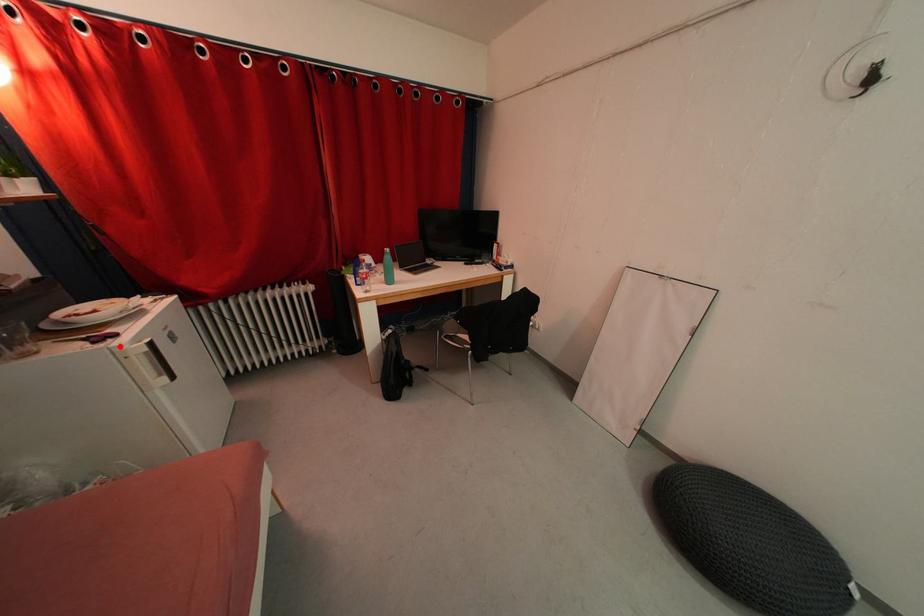
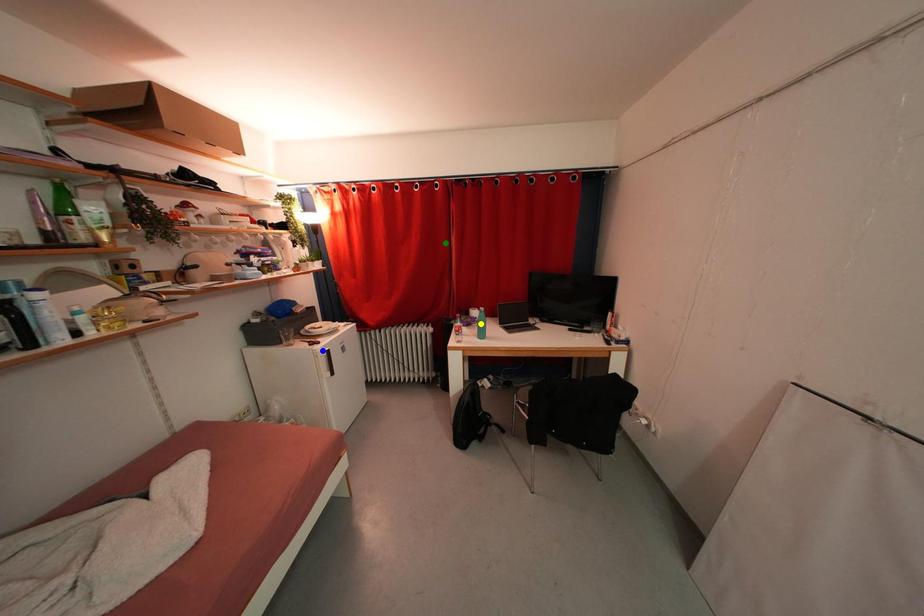
Question: I am providing you with two images of the same scene from different viewpoints. A red point is marked on the first image. You are given multiple points on the second image. Which point in image 2 is actually the same real-world point as the red point in image 1?

Choices:
 (A) yellow point
 (B) blue point
 (C) green point

Answer: (B)